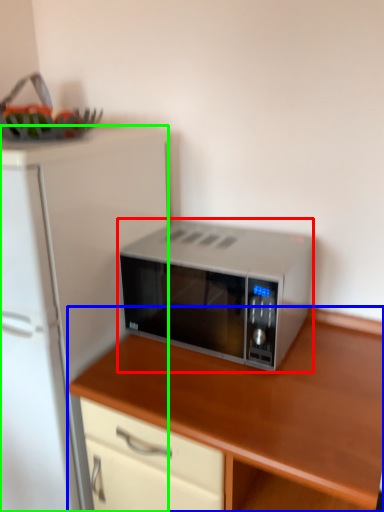
Question: Which object is the closest to the microwave oven (highlighted by a red box)? Choose among these: cabinetry (highlighted by a blue box) or refrigerator (highlighted by a green box).

Choices:
 (A) cabinetry
 (B) refrigerator

Answer: (A)